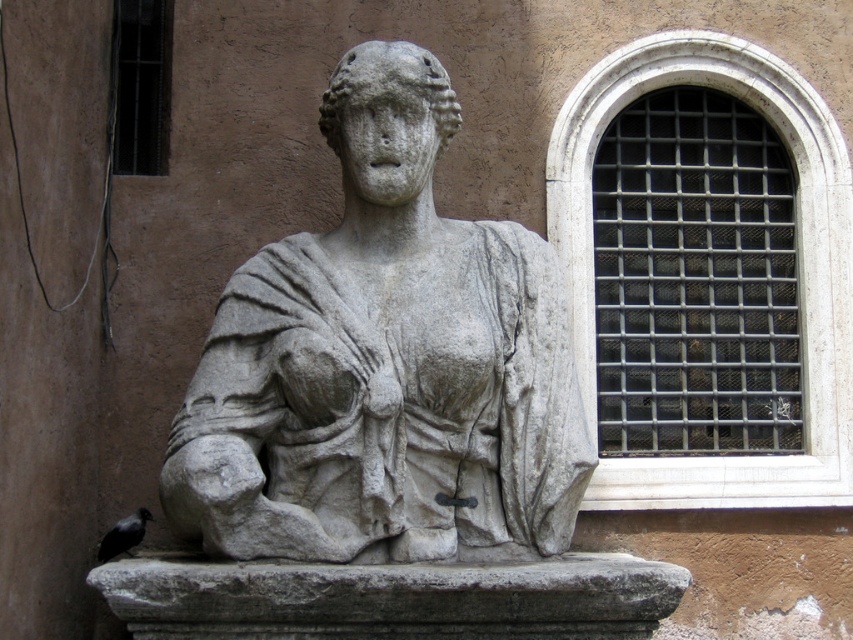
Question: Which object is closer to the camera taking this photo?

Choices:
 (A) metallic grid at upper left
 (B) gray stone bust at center

Answer: (B)

Question: Which point is closer to the camera?

Choices:
 (A) (306, 262)
 (B) (157, 6)

Answer: (A)

Question: Considering the real-world distances, which object is closest to the metallic grid window at upper right?

Choices:
 (A) metallic grid at upper left
 (B) gray stone bust at center

Answer: (B)

Question: Is gray stone bust at center smaller than metallic grid window at upper right?

Choices:
 (A) no
 (B) yes

Answer: (A)

Question: Observing the image, what is the correct spatial positioning of gray stone bust at center in reference to metallic grid at upper left?

Choices:
 (A) above
 (B) below

Answer: (B)

Question: Can you confirm if gray stone bust at center is thinner than metallic grid at upper left?

Choices:
 (A) yes
 (B) no

Answer: (B)